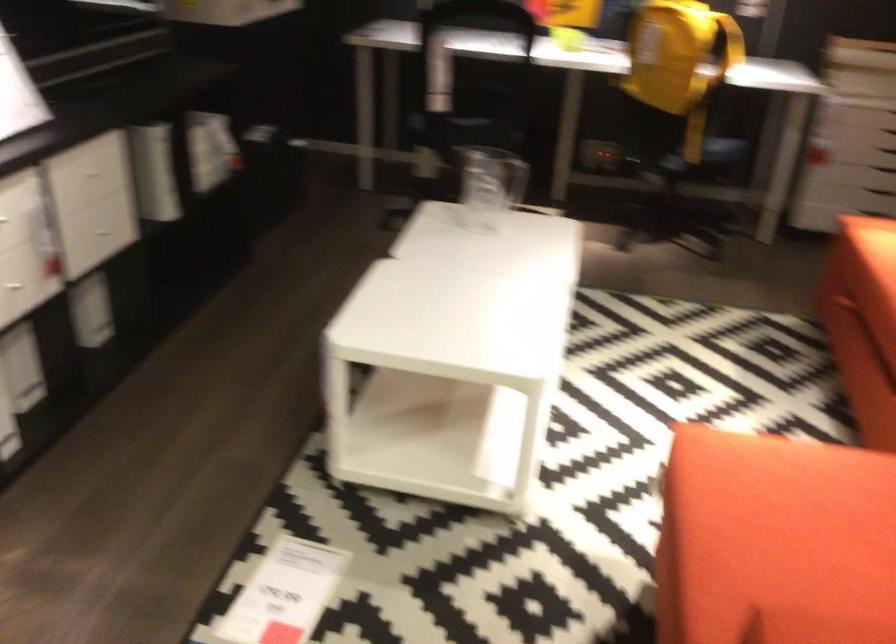
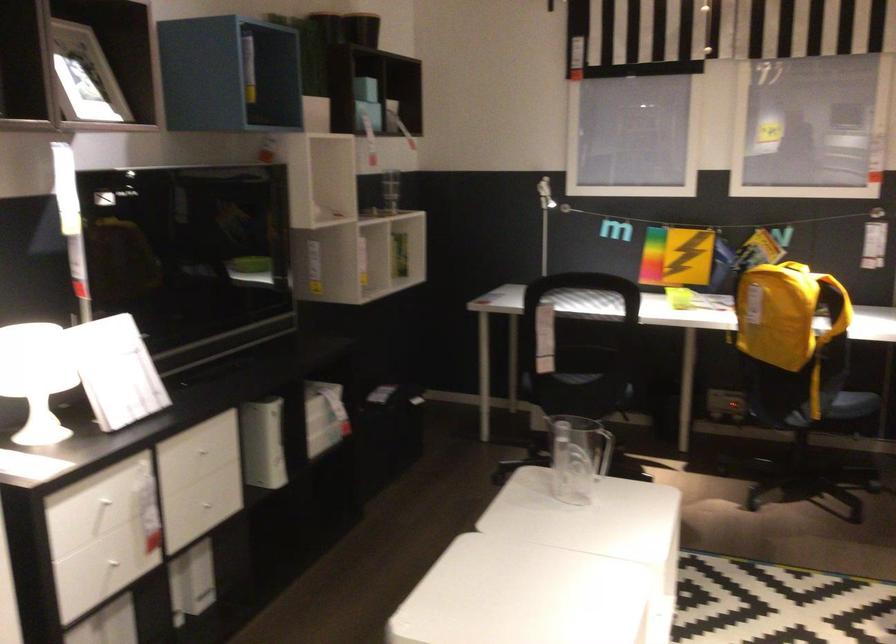
The point at (719, 146) is marked in the first image. Where is the corresponding point in the second image?

(854, 404)